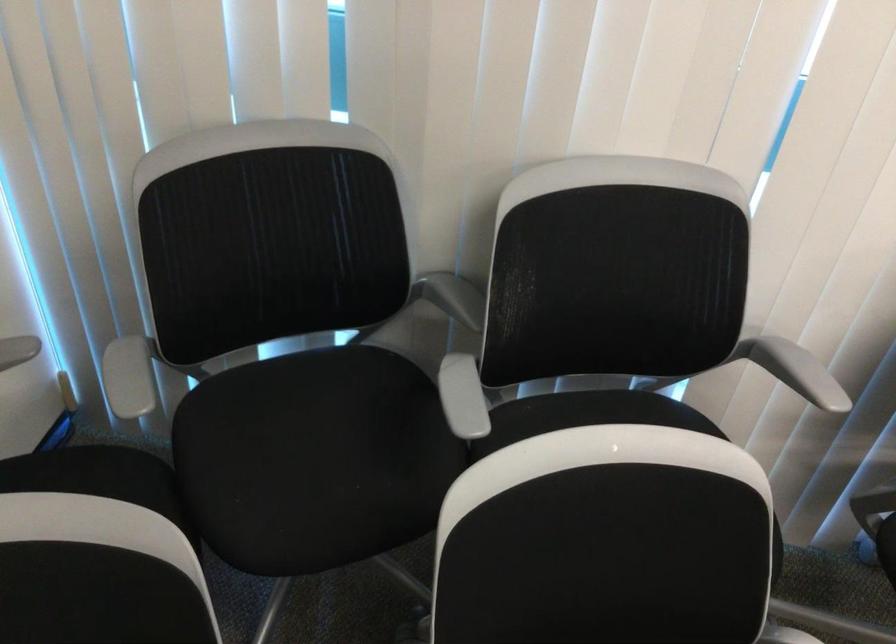
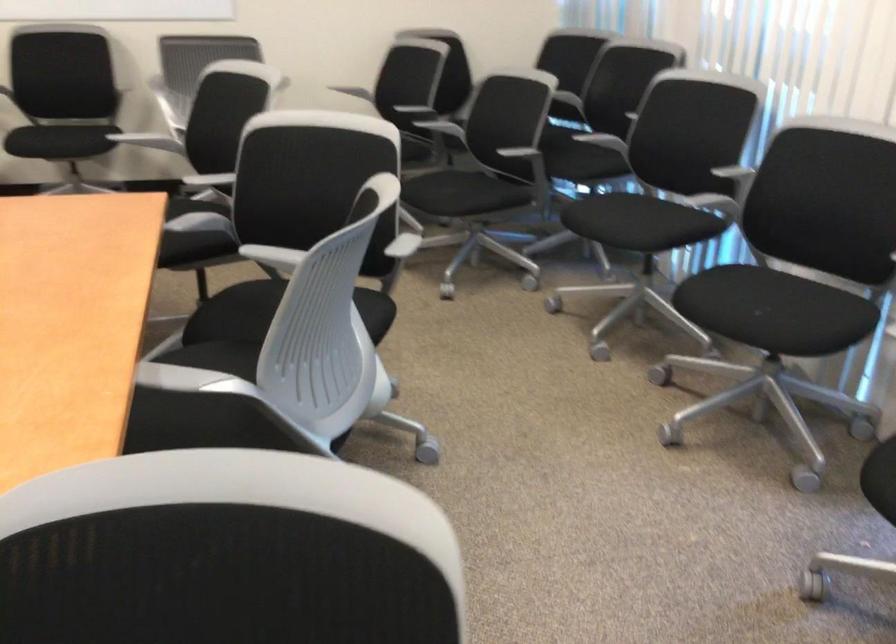
Question: I am providing you with two images of the same scene from different viewpoints. After the viewpoint changes to image2, which objects are now occluded?

Choices:
 (A) chair sitting surface
 (B) pink flip-flop
 (C) grey chair armrest
 (D) white chair armrest

Answer: (C)